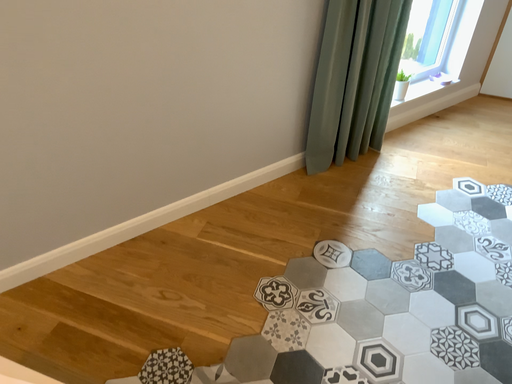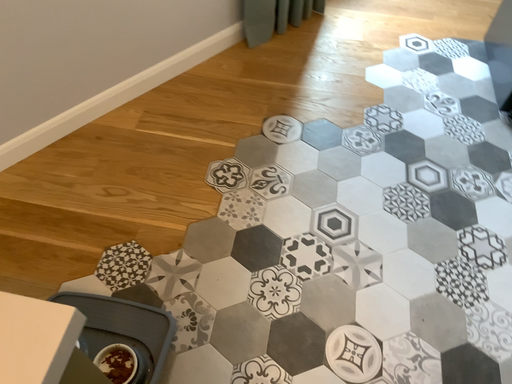
Question: How did the camera likely rotate when shooting the video?

Choices:
 (A) rotated upward
 (B) rotated downward

Answer: (B)